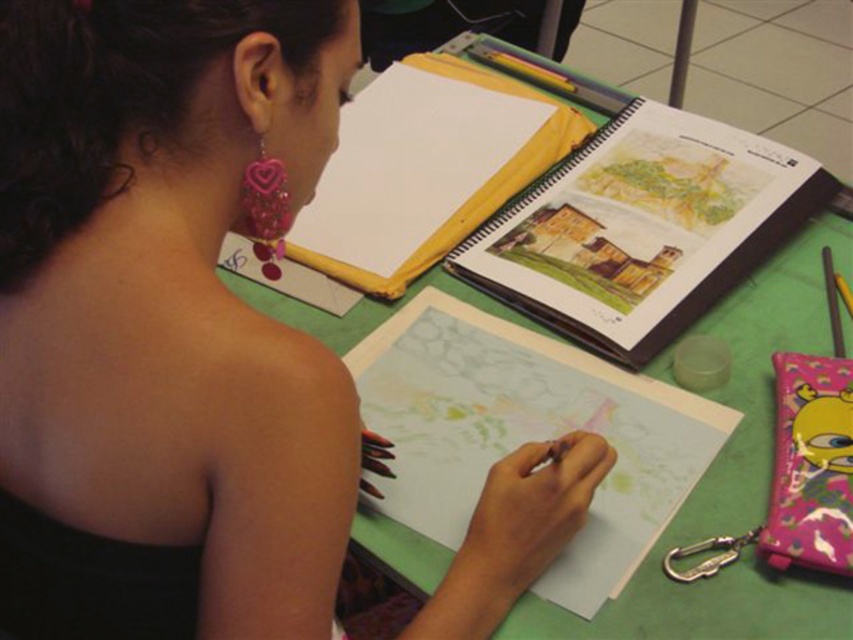
Which is above, matte black dress at center or green matte table at center?

matte black dress at center is above.

Does matte black dress at center have a smaller size compared to green matte table at center?

Correct, matte black dress at center occupies less space than green matte table at center.

Does point (109, 596) lie in front of point (746, 512)?

That is True.

Identify the location of matte black dress at center. This screenshot has height=640, width=853. (165, 321).